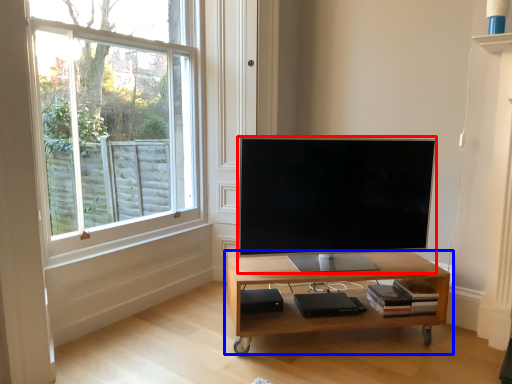
Question: Which object appears closest to the camera in this image, television (highlighted by a red box) or table (highlighted by a blue box)?

Choices:
 (A) television
 (B) table

Answer: (A)